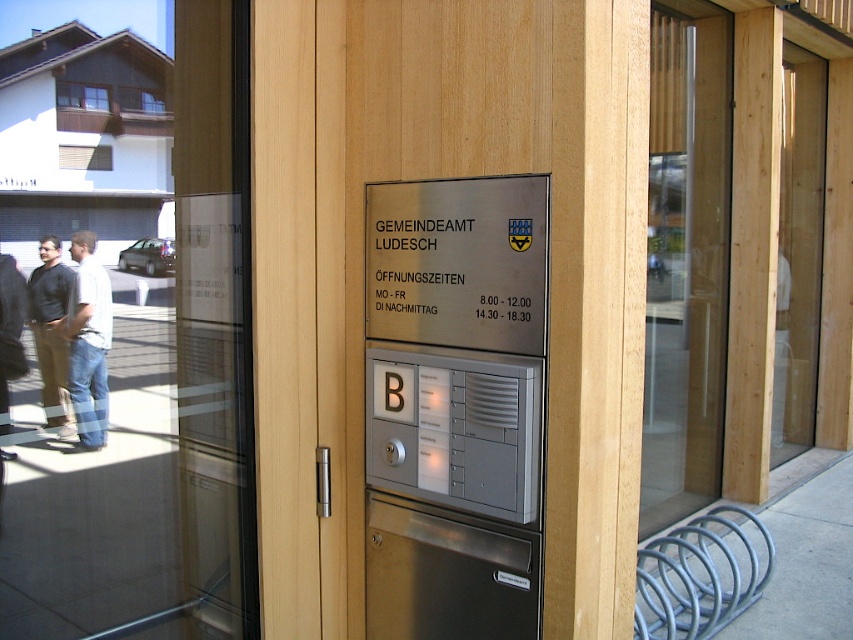
Can you confirm if denim jeans at left is positioned above dark brown pants at left?

No.

Find the location of `denim jeans at left`. denim jeans at left is located at coordinates (88, 342).

Can you confirm if metallic silver door at center is wider than transparent glass door at center?

Correct, the width of metallic silver door at center exceeds that of transparent glass door at center.

Who is more distant from viewer, (544, 24) or (676, 285)?

Positioned behind is point (676, 285).

Is point (538, 140) in front of point (693, 211)?

Yes, it is in front of point (693, 211).

At what (x,y) coordinates should I click in order to perform the action: click on metallic silver door at center. Please return your answer as a coordinate pair (x, y). The image size is (853, 640). Looking at the image, I should click on (363, 266).

Does transparent glass door at center appear under dark brown pants at left?

Actually, transparent glass door at center is above dark brown pants at left.

Is point (682, 456) closer to camera compared to point (33, 326)?

That is False.

Between point (672, 467) and point (42, 337), which one is positioned in front?

Point (42, 337) is in front.

Locate an element on the screen. transparent glass door at center is located at coordinates (685, 262).